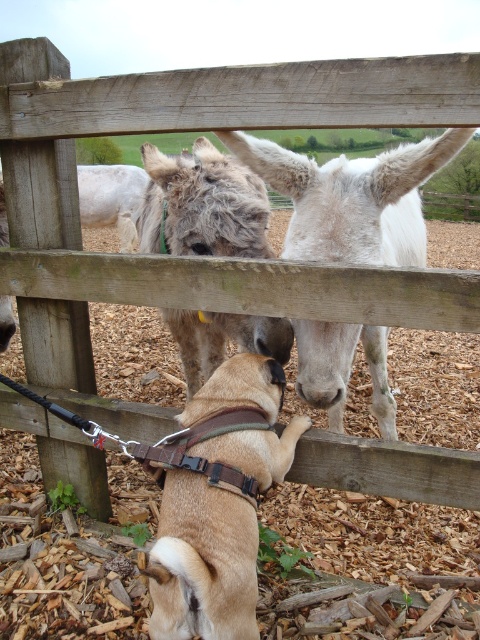
Question: Which of these objects is positioned farthest from the fuzzy gray mule at center?

Choices:
 (A) brown leather harness at lower center
 (B) white matte donkey at center

Answer: (A)

Question: Which object is the closest to the fuzzy gray mule at center?

Choices:
 (A) brown leather harness at lower center
 (B) white matte donkey at center

Answer: (B)

Question: Is brown leather harness at lower center bigger than white matte donkey at center?

Choices:
 (A) no
 (B) yes

Answer: (A)

Question: Can you confirm if brown leather harness at lower center is thinner than fuzzy gray mule at center?

Choices:
 (A) no
 (B) yes

Answer: (B)

Question: Is brown leather harness at lower center further to the viewer compared to white matte donkey at center?

Choices:
 (A) yes
 (B) no

Answer: (B)

Question: Based on their relative distances, which object is farther from the fuzzy gray mule at center?

Choices:
 (A) white matte donkey at center
 (B) brown leather harness at lower center

Answer: (B)